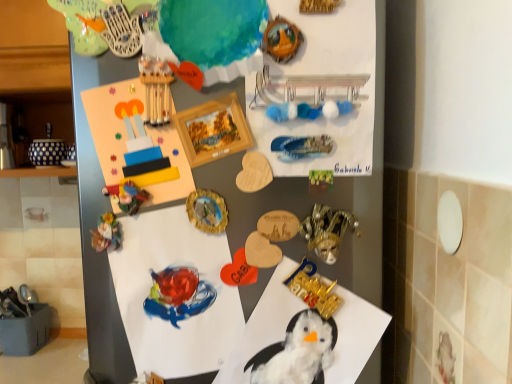
Question: From the image's perspective, is porcelain figurine at lower left, arranged as the first art when ordered from the bottom, located beneath white fluffy paper at center, which appears as the third paper when viewed from the top?

Choices:
 (A) no
 (B) yes

Answer: (A)

Question: Is porcelain figurine at lower left, which is counted as the second art, starting from the top, placed right next to white fluffy paper at center, which appears as the first paper when ordered from the bottom?

Choices:
 (A) no
 (B) yes

Answer: (A)

Question: Is porcelain figurine at lower left, arranged as the first art when ordered from the bottom, closer to the viewer compared to white fluffy paper at center, which appears as the third paper when viewed from the top?

Choices:
 (A) no
 (B) yes

Answer: (A)

Question: Can you confirm if porcelain figurine at lower left, which is counted as the second art, starting from the top, is thinner than white fluffy paper at center, which appears as the third paper when viewed from the top?

Choices:
 (A) yes
 (B) no

Answer: (A)

Question: Is white fluffy paper at center, which appears as the third paper when viewed from the top, at the back of porcelain figurine at lower left, arranged as the first art when ordered from the bottom?

Choices:
 (A) no
 (B) yes

Answer: (A)

Question: Can you confirm if porcelain figurine at lower left, which is counted as the second art, starting from the top, is positioned to the right of white fluffy paper at center, which appears as the first paper when ordered from the bottom?

Choices:
 (A) no
 (B) yes

Answer: (A)

Question: From the image's perspective, is matte plastic toy at center-left, the first art in the top-to-bottom sequence, over wooden postcard at upper center?

Choices:
 (A) yes
 (B) no

Answer: (B)

Question: Does matte plastic toy at center-left, which ranks as the 2th art in bottom-to-top order, lie in front of wooden postcard at upper center?

Choices:
 (A) yes
 (B) no

Answer: (B)

Question: From the image's perspective, is matte plastic toy at center-left, which ranks as the 2th art in bottom-to-top order, located beneath wooden postcard at upper center?

Choices:
 (A) yes
 (B) no

Answer: (A)

Question: Is matte plastic toy at center-left, which ranks as the 2th art in bottom-to-top order, oriented away from wooden postcard at upper center?

Choices:
 (A) yes
 (B) no

Answer: (A)

Question: Considering the relative sizes of matte plastic toy at center-left, the first art in the top-to-bottom sequence, and wooden postcard at upper center in the image provided, is matte plastic toy at center-left, the first art in the top-to-bottom sequence, shorter than wooden postcard at upper center?

Choices:
 (A) yes
 (B) no

Answer: (A)

Question: Is matte plastic toy at center-left, the first art in the top-to-bottom sequence, not close to wooden postcard at upper center?

Choices:
 (A) yes
 (B) no

Answer: (B)

Question: From the image's perspective, would you say watercolor paper at center, placed as the second paper when sorted from bottom to top, is positioned over white fluffy paper at center, which appears as the third paper when viewed from the top?

Choices:
 (A) yes
 (B) no

Answer: (A)